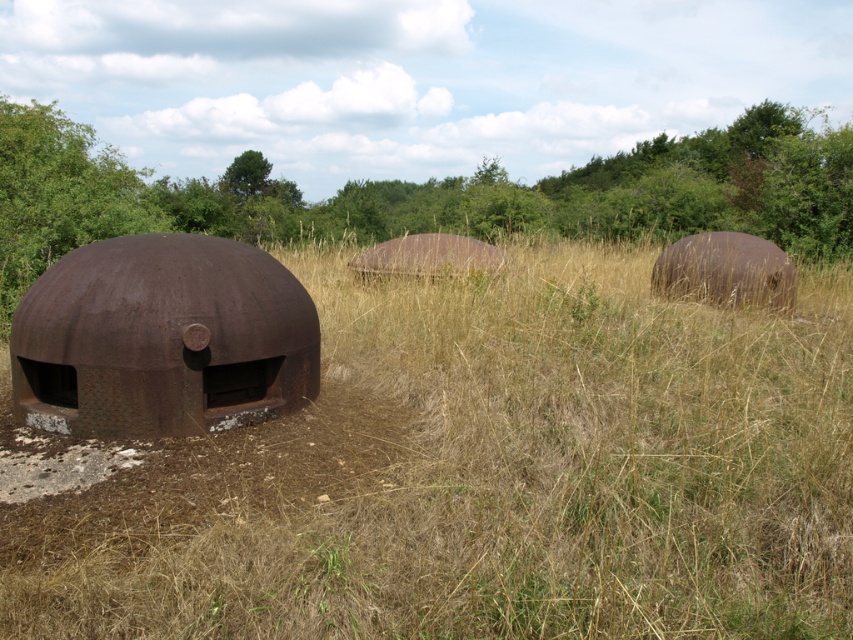
Who is positioned more to the right, green leafy tree at upper center or rusty metal bunker at left?

Positioned to the right is green leafy tree at upper center.

In the scene shown: How much distance is there between green leafy tree at upper center and rusty metal bunker at left?

They are 13.43 meters apart.

Does point (169, 184) come closer to viewer compared to point (163, 433)?

No, it is not.

The image size is (853, 640). Identify the location of green leafy tree at upper center. click(430, 195).

Is brown dry grass at center further to camera compared to green leafy tree at upper center?

No, brown dry grass at center is in front of green leafy tree at upper center.

The width and height of the screenshot is (853, 640). Describe the element at coordinates (486, 474) in the screenshot. I see `brown dry grass at center` at that location.

Is point (817, 557) behind point (788, 204)?

That is False.

Locate an element on the screen. The image size is (853, 640). brown dry grass at center is located at coordinates (486, 474).

You are a GUI agent. You are given a task and a screenshot of the screen. Output one action in this format:
    pyautogui.click(x=<x>, y=<y>)
    Task: Click on the brown dry grass at center
    Image resolution: width=853 pixels, height=640 pixels.
    Given the screenshot: What is the action you would take?
    pyautogui.click(x=486, y=474)

In order to click on brown dry grass at center in this screenshot , I will do `click(486, 474)`.